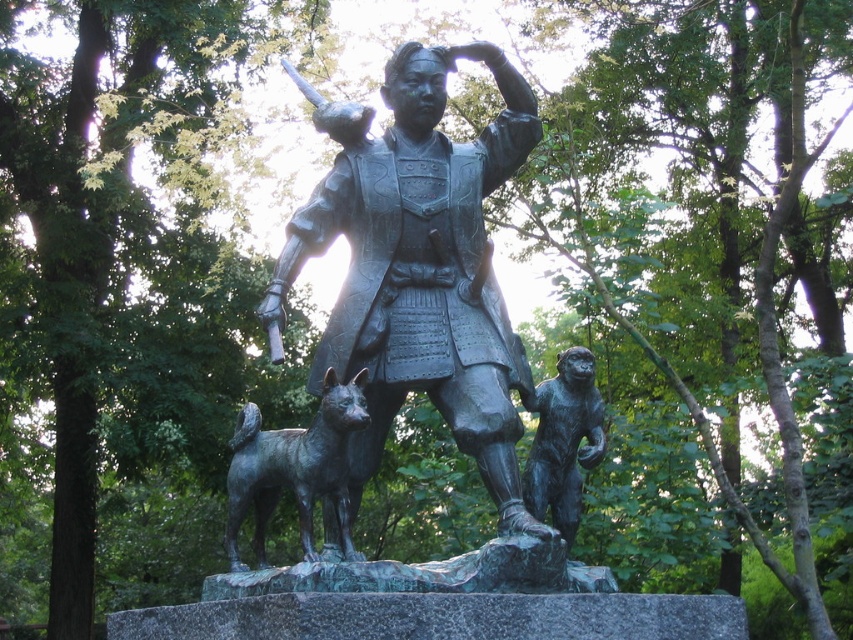
Question: Does bronze statue at center appear on the right side of bronze monkey at right?

Choices:
 (A) yes
 (B) no

Answer: (B)

Question: Does bronze dog at center appear over bronze monkey at right?

Choices:
 (A) yes
 (B) no

Answer: (B)

Question: Among these objects, which one is farthest from the camera?

Choices:
 (A) bronze monkey at right
 (B) bronze statue at center

Answer: (A)

Question: Which of the following is the farthest from the observer?

Choices:
 (A) (558, 502)
 (B) (289, 454)

Answer: (A)

Question: Does bronze statue at center appear on the right side of bronze dog at center?

Choices:
 (A) no
 (B) yes

Answer: (B)

Question: Which object is closer to the camera taking this photo?

Choices:
 (A) bronze monkey at right
 (B) bronze dog at center

Answer: (B)